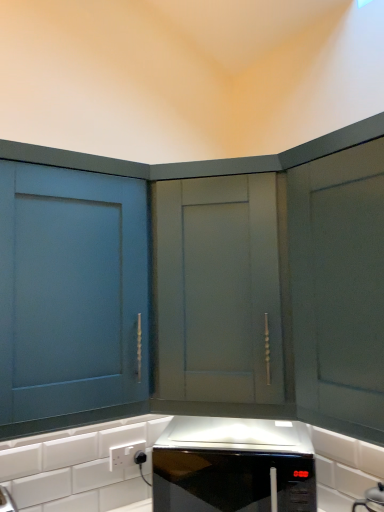
Question: Is matte gray cabinet at center, which appears as the 1th cabinetry when viewed from the right, positioned with its back to white plastic electric outlet at lower center?

Choices:
 (A) no
 (B) yes

Answer: (A)

Question: From the image's perspective, is matte gray cabinet at center, which appears as the 1th cabinetry when viewed from the right, above white plastic electric outlet at lower center?

Choices:
 (A) yes
 (B) no

Answer: (A)

Question: Is matte gray cabinet at center, placed as the second cabinetry when sorted from left to right, positioned far away from white plastic electric outlet at lower center?

Choices:
 (A) yes
 (B) no

Answer: (B)

Question: Could you tell me if matte gray cabinet at center, placed as the second cabinetry when sorted from left to right, is turned towards white plastic electric outlet at lower center?

Choices:
 (A) no
 (B) yes

Answer: (A)

Question: Considering the relative sizes of matte gray cabinet at center, which appears as the 1th cabinetry when viewed from the right, and white plastic electric outlet at lower center in the image provided, is matte gray cabinet at center, which appears as the 1th cabinetry when viewed from the right, thinner than white plastic electric outlet at lower center?

Choices:
 (A) yes
 (B) no

Answer: (B)

Question: From the image's perspective, is matte gray cabinet at center, which appears as the 1th cabinetry when viewed from the right, beneath white plastic electric outlet at lower center?

Choices:
 (A) no
 (B) yes

Answer: (A)

Question: Does white plastic electric outlet at lower center come behind matte blue cabinet at left, which ranks as the first cabinetry in left-to-right order?

Choices:
 (A) no
 (B) yes

Answer: (B)

Question: Can you confirm if white plastic electric outlet at lower center is wider than matte blue cabinet at left, which ranks as the first cabinetry in left-to-right order?

Choices:
 (A) yes
 (B) no

Answer: (B)

Question: From a real-world perspective, is white plastic electric outlet at lower center positioned under matte blue cabinet at left, which is counted as the 2th cabinetry, starting from the right, based on gravity?

Choices:
 (A) yes
 (B) no

Answer: (A)

Question: Can you confirm if white plastic electric outlet at lower center is taller than matte blue cabinet at left, which is counted as the 2th cabinetry, starting from the right?

Choices:
 (A) no
 (B) yes

Answer: (A)

Question: Is matte blue cabinet at left, which ranks as the first cabinetry in left-to-right order, inside white plastic electric outlet at lower center?

Choices:
 (A) yes
 (B) no

Answer: (B)

Question: From a real-world perspective, is white plastic electric outlet at lower center on top of matte blue cabinet at left, which is counted as the 2th cabinetry, starting from the right?

Choices:
 (A) yes
 (B) no

Answer: (B)

Question: Is matte blue cabinet at left, which ranks as the first cabinetry in left-to-right order, not near black glossy microwave at center?

Choices:
 (A) no
 (B) yes

Answer: (A)